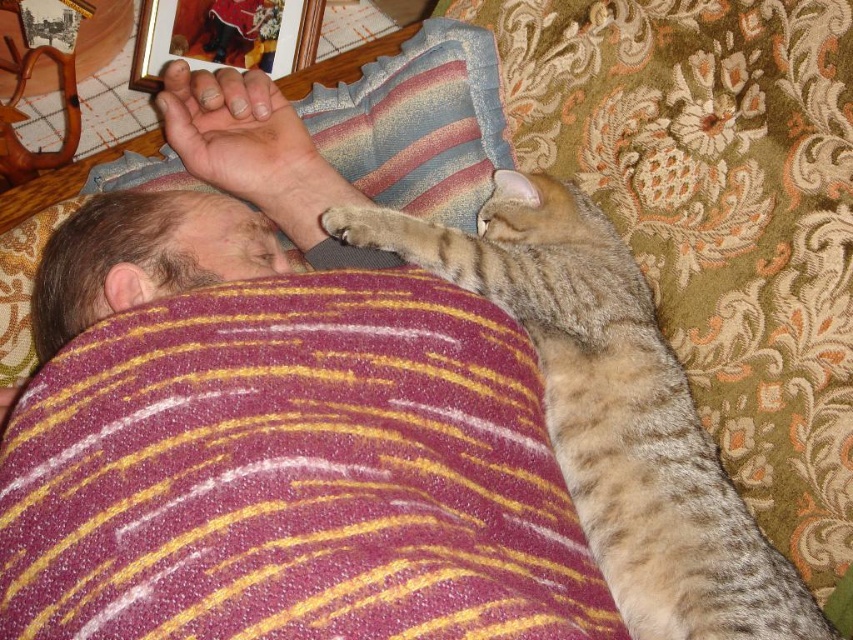
Is point (488, 296) in front of point (265, 198)?

That is True.

Is point (430, 260) behind point (201, 115)?

No, it is in front of (201, 115).

Is point (569, 429) positioned in front of point (172, 132)?

Yes.

Locate an element on the screen. The height and width of the screenshot is (640, 853). tabby fur cat at upper right is located at coordinates (612, 412).